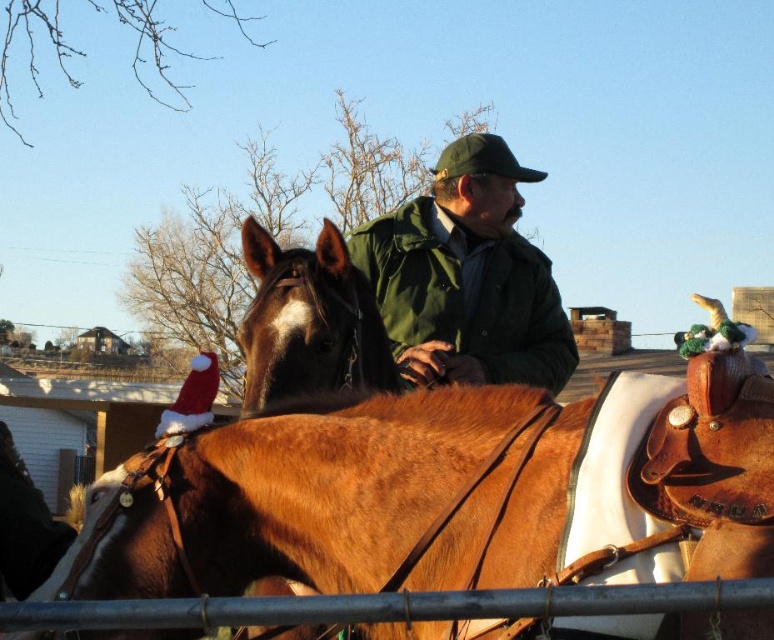
Question: Estimate the real-world distances between objects in this image. Which object is farther from the green matte jacket at center?

Choices:
 (A) brown leather saddle at center
 (B) brown leather horse at center

Answer: (A)

Question: Does green matte jacket at center have a greater width compared to brown leather horse at center?

Choices:
 (A) no
 (B) yes

Answer: (B)

Question: Can you confirm if green matte jacket at center is positioned below brown leather horse at center?

Choices:
 (A) yes
 (B) no

Answer: (B)

Question: Among these objects, which one is farthest from the camera?

Choices:
 (A) brown leather saddle at center
 (B) green matte jacket at center

Answer: (B)

Question: Is brown leather saddle at center wider than brown leather horse at center?

Choices:
 (A) yes
 (B) no

Answer: (A)

Question: Among these points, which one is farthest from the camera?

Choices:
 (A) (303, 298)
 (B) (519, 372)

Answer: (B)